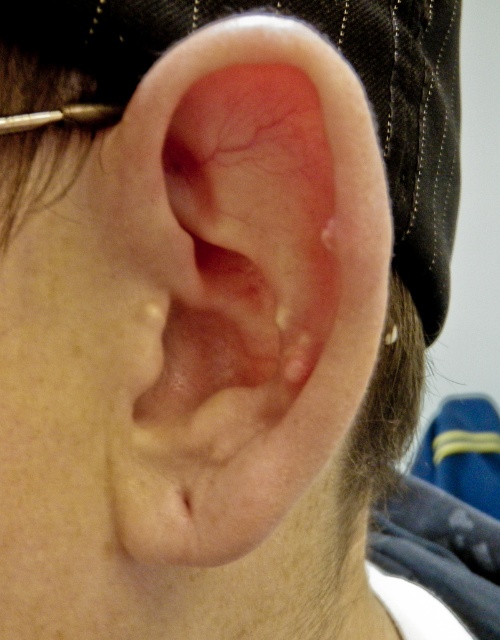
Based on the photo, you are a medical professional examining a patient. You notice a point at coordinates (x=204, y=323) on the ear. If the distance from this point to the camera is 9.70 inches, and the standard ear canal depth for an adult is about 1 inch, is this point likely located inside the ear canal or outside the ear canal?

The point at coordinates (x=204, y=323) is 9.70 inches away from the camera, which is significantly farther than the standard ear canal depth of 1 inch. Therefore, this point is likely located outside the ear canal rather than inside it.